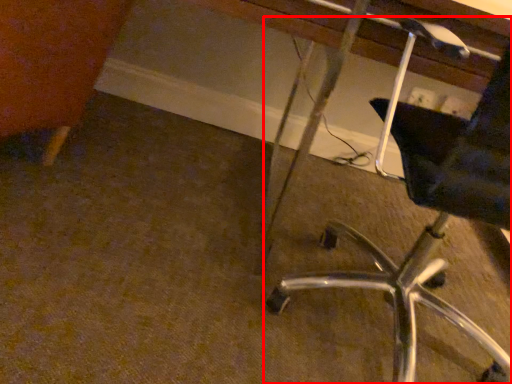
Question: In this image, where is chair (annotated by the red box) located relative to vanity?

Choices:
 (A) left
 (B) right

Answer: (B)